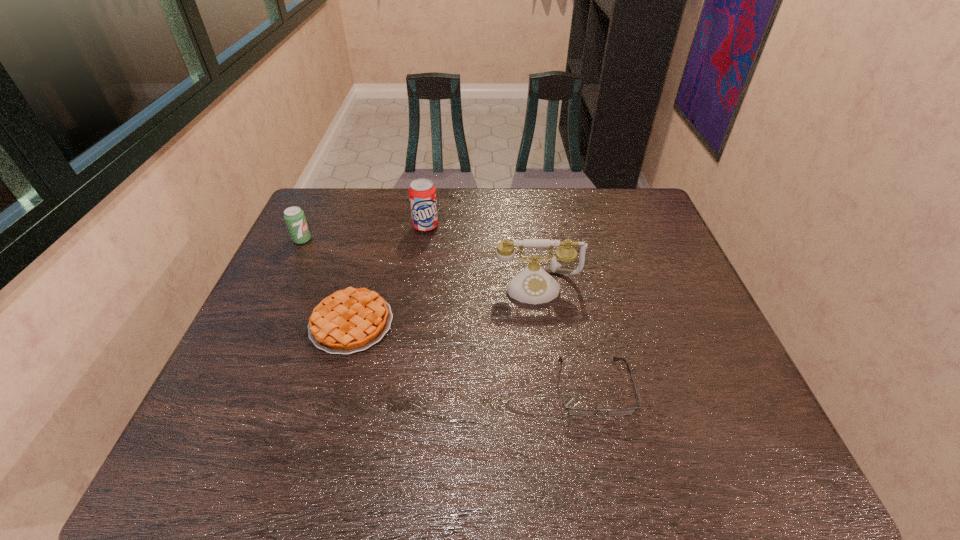
Where is `free space located on the back of the second object from left to right`? The height and width of the screenshot is (540, 960). free space located on the back of the second object from left to right is located at coordinates (374, 241).

Locate an element on the screen. vacant region located 0.060m on the front-facing side of the nearest object is located at coordinates (607, 448).

Where is `object present at the far edge`? object present at the far edge is located at coordinates click(x=422, y=193).

What are the coordinates of `soda at the left edge` in the screenshot? It's located at (295, 219).

Image resolution: width=960 pixels, height=540 pixels. In order to click on pie present at the left edge in this screenshot , I will do `click(351, 320)`.

Find the location of a particular element. The width and height of the screenshot is (960, 540). vacant space at the far edge of the desktop is located at coordinates (378, 199).

Where is `free space at the near edge`? free space at the near edge is located at coordinates (632, 464).

Where is `vacant space at the left edge of the desktop`? This screenshot has height=540, width=960. vacant space at the left edge of the desktop is located at coordinates (327, 250).

Image resolution: width=960 pixels, height=540 pixels. What are the coordinates of `free spot at the right edge of the desktop` in the screenshot? It's located at (652, 268).

The image size is (960, 540). I want to click on vacant space at the far right corner of the desktop, so click(619, 214).